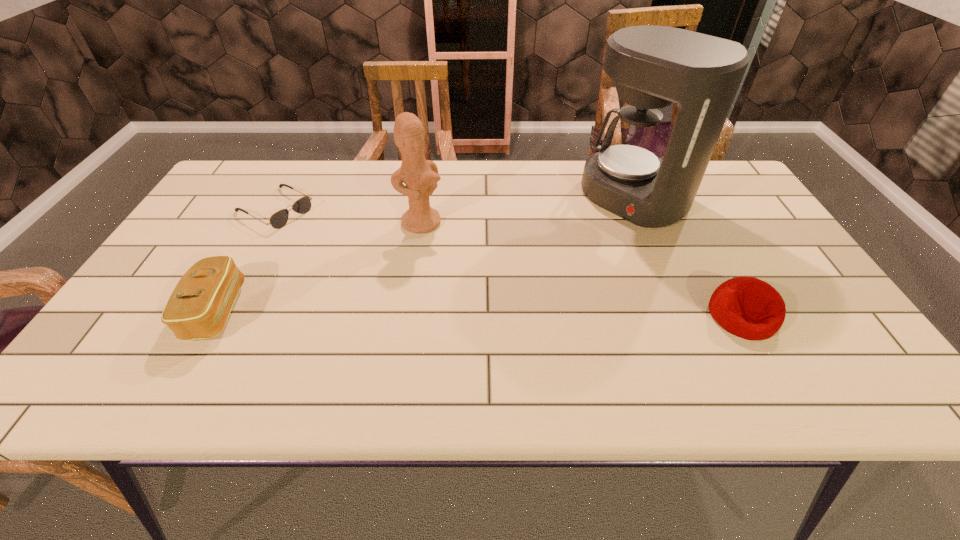
At what (x,y) coordinates should I click in order to perform the action: click on clutch bag. Please return your answer as a coordinate pair (x, y). Looking at the image, I should click on (198, 308).

I want to click on beanbag, so click(x=747, y=307).

Identify the location of the shortest object. (279, 219).

I want to click on the second tallest object, so click(420, 175).

This screenshot has height=540, width=960. I want to click on figurine, so click(420, 175).

In order to click on coffee maker in this screenshot , I will do [x=653, y=66].

The width and height of the screenshot is (960, 540). I want to click on vacant region located on the zipper side of the clutch bag, so click(x=290, y=310).

Locate an element on the screen. blank space located 0.280m on the front-facing side of the sunglasses is located at coordinates (372, 264).

Locate an element on the screen. This screenshot has width=960, height=540. vacant space located on the front-facing side of the sunglasses is located at coordinates (343, 247).

I want to click on vacant space located 0.350m on the front-facing side of the sunglasses, so click(394, 275).